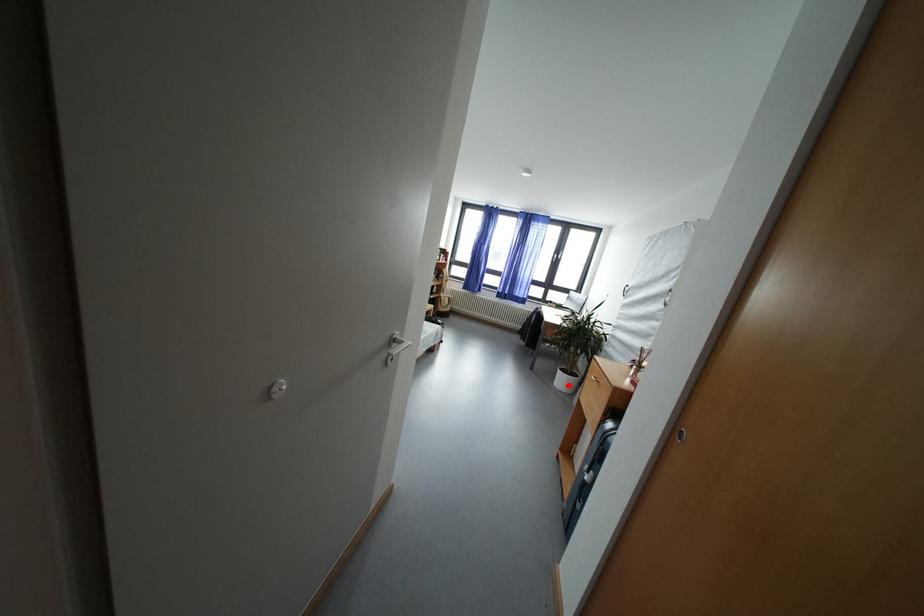
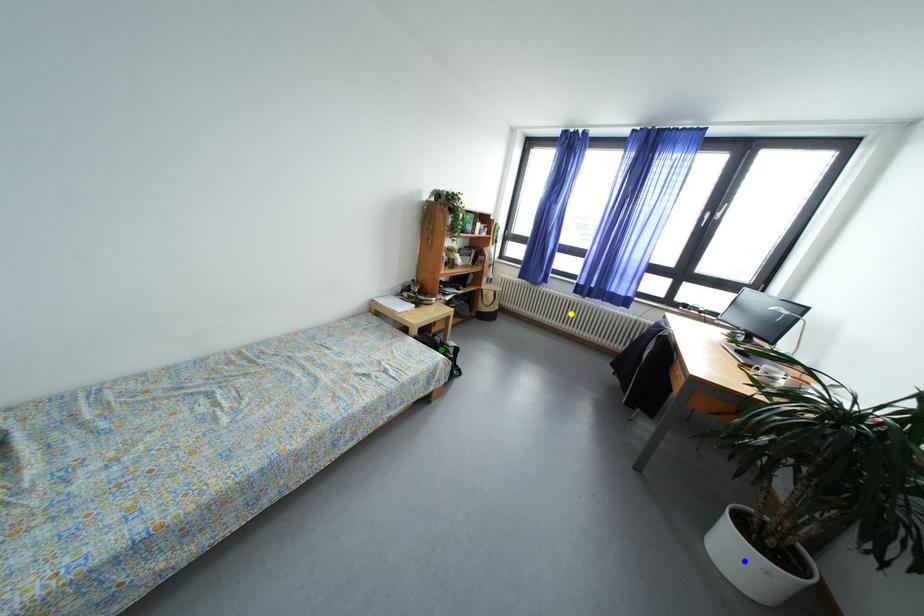
Question: I am providing you with two images of the same scene from different viewpoints. A red point is marked on the first image. You are given multiple points on the second image. Which point in image 2 is actually the same real-world point as the red point in image 1?

Choices:
 (A) yellow point
 (B) green point
 (C) blue point

Answer: (C)